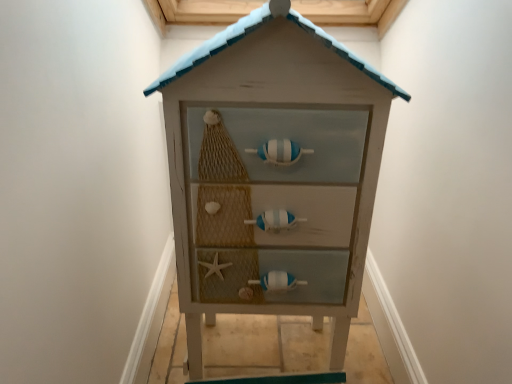
Where is `wooden chest of drawers at center`? wooden chest of drawers at center is located at coordinates (272, 173).

What do you see at coordinates (272, 173) in the screenshot?
I see `wooden chest of drawers at center` at bounding box center [272, 173].

The width and height of the screenshot is (512, 384). I want to click on wooden chest of drawers at center, so click(272, 173).